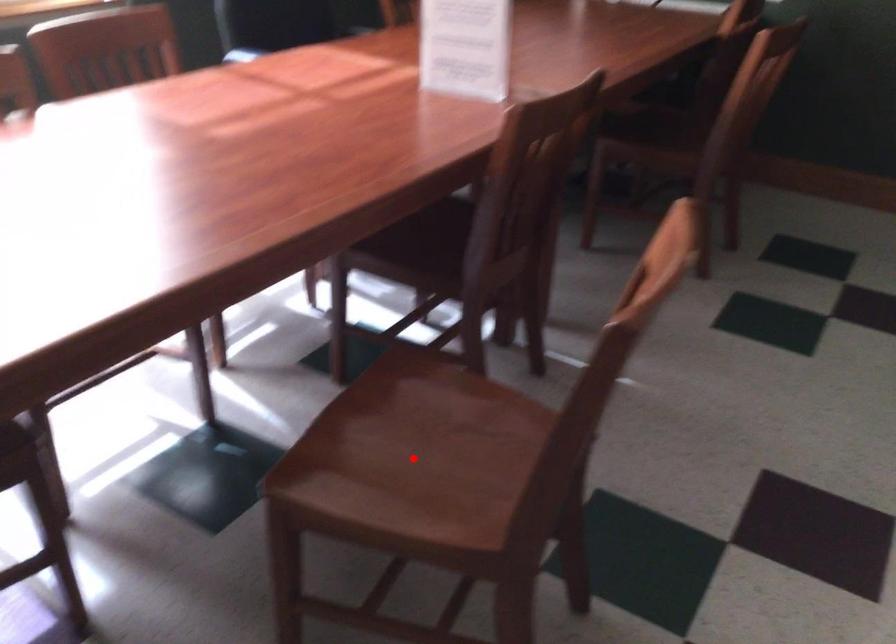
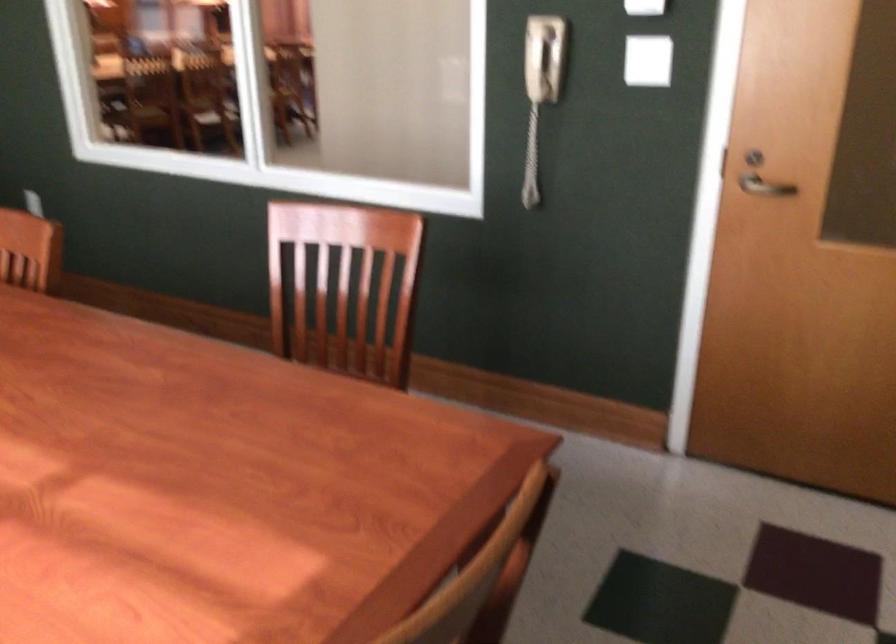
Question: I am providing you with two images of the same scene from different viewpoints. A red point is marked on the first image. At the location where the point appears in image 1, is it still visible in image 2?

Choices:
 (A) Yes
 (B) No

Answer: (B)